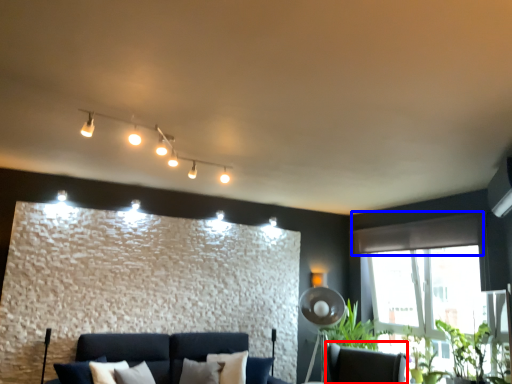
Question: Which of the following is the farthest to the observer, swivel chair (highlighted by a red box) or curtain (highlighted by a blue box)?

Choices:
 (A) swivel chair
 (B) curtain

Answer: (B)